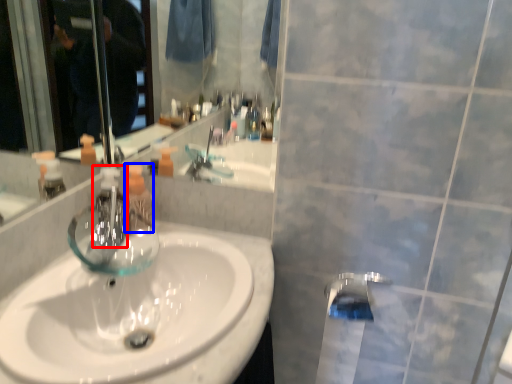
Question: Which object appears farthest to the camera in this image, faucet (highlighted by a red box) or mouthwash (highlighted by a blue box)?

Choices:
 (A) faucet
 (B) mouthwash

Answer: (B)